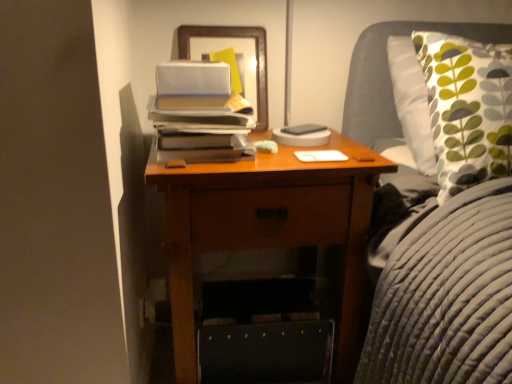
Image resolution: width=512 pixels, height=384 pixels. What do you see at coordinates (267, 226) in the screenshot? I see `wooden nightstand at center` at bounding box center [267, 226].

Describe the element at coordinates (234, 37) in the screenshot. The width and height of the screenshot is (512, 384). I see `wooden picture frame at upper center` at that location.

The width and height of the screenshot is (512, 384). What do you see at coordinates (303, 129) in the screenshot?
I see `hardcover book at center` at bounding box center [303, 129].

At what (x,y) coordinates should I click in order to perform the action: click on hardcover book at center. Please return your answer as a coordinate pair (x, y). This screenshot has height=384, width=512. Looking at the image, I should click on (303, 129).

What are the coordinates of `wooden nightstand at center` in the screenshot? It's located at (267, 226).

You are a GUI agent. You are given a task and a screenshot of the screen. Output one action in this format:
    pyautogui.click(x=<x>, y=<y>)
    Task: Click on the paperback book located underneath the wooden picture frame at upper center (from a real-world perspective)
    This screenshot has width=512, height=384.
    Given the screenshot: What is the action you would take?
    pyautogui.click(x=303, y=129)

From the image's perspective, between hardcover book at center and wooden picture frame at upper center, which one is located above?

From the image's view, wooden picture frame at upper center is above.

Which is in front, hardcover book at center or wooden picture frame at upper center?

wooden picture frame at upper center is in front.

Is point (263, 97) positioned in front of point (180, 211)?

No, it is behind (180, 211).

How much distance is there between wooden picture frame at upper center and wooden nightstand at center?

wooden picture frame at upper center and wooden nightstand at center are 41.67 centimeters apart from each other.

Which of these two, wooden picture frame at upper center or wooden nightstand at center, is bigger?

wooden nightstand at center is bigger.

Can you confirm if wooden picture frame at upper center is thinner than wooden nightstand at center?

Yes.

Looking at this image, between hardcover book at center and wooden nightstand at center, which one has larger width?

With larger width is wooden nightstand at center.

Is hardcover book at center oriented towards wooden nightstand at center?

No, hardcover book at center is not oriented towards wooden nightstand at center.

From the image's perspective, relative to wooden nightstand at center, is hardcover book at center above or below?

hardcover book at center is above wooden nightstand at center.

Could wooden nightstand at center be considered to be inside hardcover book at center?

No, hardcover book at center does not contain wooden nightstand at center.

Is wooden picture frame at upper center facing away from hardcover book at center?

wooden picture frame at upper center does not have its back to hardcover book at center.

Based on the photo, is wooden picture frame at upper center far from hardcover book at center?

Actually, wooden picture frame at upper center and hardcover book at center are a little close together.

From the image's perspective, is wooden picture frame at upper center located above or below hardcover book at center?

wooden picture frame at upper center is above hardcover book at center.

From a real-world perspective, is wooden picture frame at upper center physically above hardcover book at center?

Yes.

Is wooden nightstand at center aimed at wooden picture frame at upper center?

No, wooden nightstand at center is not oriented towards wooden picture frame at upper center.

Is wooden nightstand at center further to camera compared to wooden picture frame at upper center?

No.

In the image, is wooden nightstand at center on the left side or the right side of wooden picture frame at upper center?

Based on their positions, wooden nightstand at center is located to the right of wooden picture frame at upper center.

Considering the relative sizes of wooden nightstand at center and wooden picture frame at upper center in the image provided, is wooden nightstand at center shorter than wooden picture frame at upper center?

In fact, wooden nightstand at center may be taller than wooden picture frame at upper center.

Consider the image. Would you say wooden nightstand at center contains hardcover book at center?

Yes, wooden nightstand at center is surrounding hardcover book at center.

In the scene shown: Which is less distant, (331, 199) or (296, 127)?

The point (331, 199) is more forward.

Can you confirm if wooden nightstand at center is thinner than hardcover book at center?

No, wooden nightstand at center is not thinner than hardcover book at center.

Where is `picture frame that appears on the left of hardcover book at center`? This screenshot has height=384, width=512. picture frame that appears on the left of hardcover book at center is located at coordinates (234, 37).

In order to click on picture frame behind the wooden nightstand at center in this screenshot , I will do `click(234, 37)`.

Estimate the real-world distances between objects in this image. Which object is further from wooden picture frame at upper center, wooden nightstand at center or hardcover book at center?

wooden nightstand at center is positioned further to the anchor wooden picture frame at upper center.

From the image, which object appears to be nearer to hardcover book at center, wooden nightstand at center or wooden picture frame at upper center?

wooden picture frame at upper center.

Which object lies further to the anchor point wooden nightstand at center, wooden picture frame at upper center or hardcover book at center?

The object further to wooden nightstand at center is hardcover book at center.

Based on their spatial positions, is hardcover book at center or wooden nightstand at center closer to wooden picture frame at upper center?

Based on the image, hardcover book at center appears to be nearer to wooden picture frame at upper center.

Looking at the image, which one is located further to wooden nightstand at center, hardcover book at center or wooden picture frame at upper center?

hardcover book at center.

Estimate the real-world distances between objects in this image. Which object is further from hardcover book at center, wooden picture frame at upper center or wooden nightstand at center?

wooden nightstand at center lies further to hardcover book at center than the other object.

Locate an element on the screen. paperback book between wooden picture frame at upper center and wooden nightstand at center in the vertical direction is located at coordinates (303, 129).